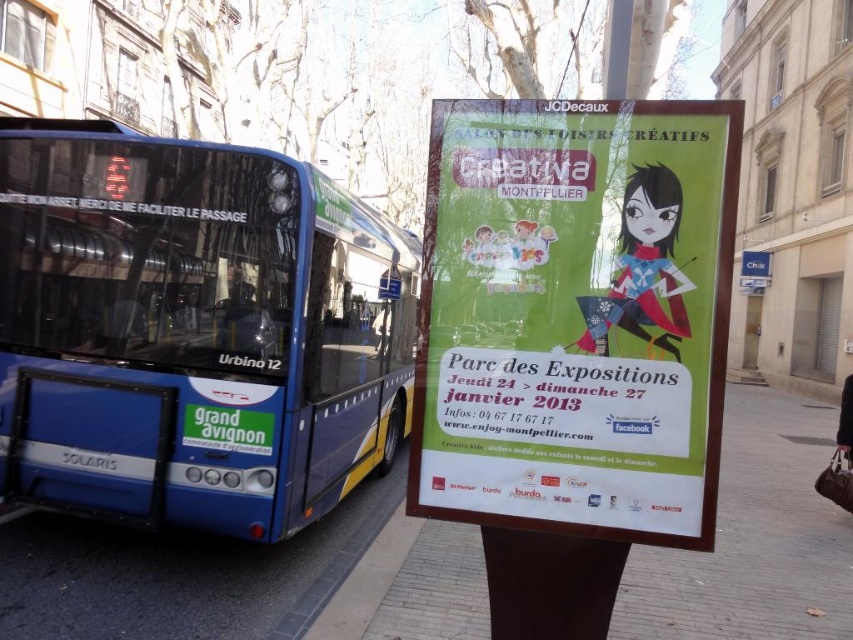
Can you confirm if blue metallic bus at left is bigger than green paper poster at right?

Yes, blue metallic bus at left is bigger than green paper poster at right.

Is blue metallic bus at left below green paper poster at right?

Yes, blue metallic bus at left is below green paper poster at right.

The height and width of the screenshot is (640, 853). What are the coordinates of `blue metallic bus at left` in the screenshot? It's located at (193, 330).

Locate an element on the screen. The height and width of the screenshot is (640, 853). blue metallic bus at left is located at coordinates (193, 330).

Is green paper poster at right shorter than smooth concrete pavement at center?

Incorrect, green paper poster at right's height does not fall short of smooth concrete pavement at center's.

Between green paper poster at right and smooth concrete pavement at center, which one has more height?

green paper poster at right is taller.

Between point (445, 454) and point (747, 428), which one is positioned behind?

Point (747, 428)

At what (x,y) coordinates should I click in order to perform the action: click on green paper poster at right. Please return your answer as a coordinate pair (x, y). Image resolution: width=853 pixels, height=640 pixels. Looking at the image, I should click on (575, 316).

Can you confirm if blue metallic bus at left is shorter than smooth concrete pavement at center?

In fact, blue metallic bus at left may be taller than smooth concrete pavement at center.

Which is in front, point (399, 310) or point (770, 445)?

Point (399, 310) is more forward.

The height and width of the screenshot is (640, 853). I want to click on blue metallic bus at left, so click(x=193, y=330).